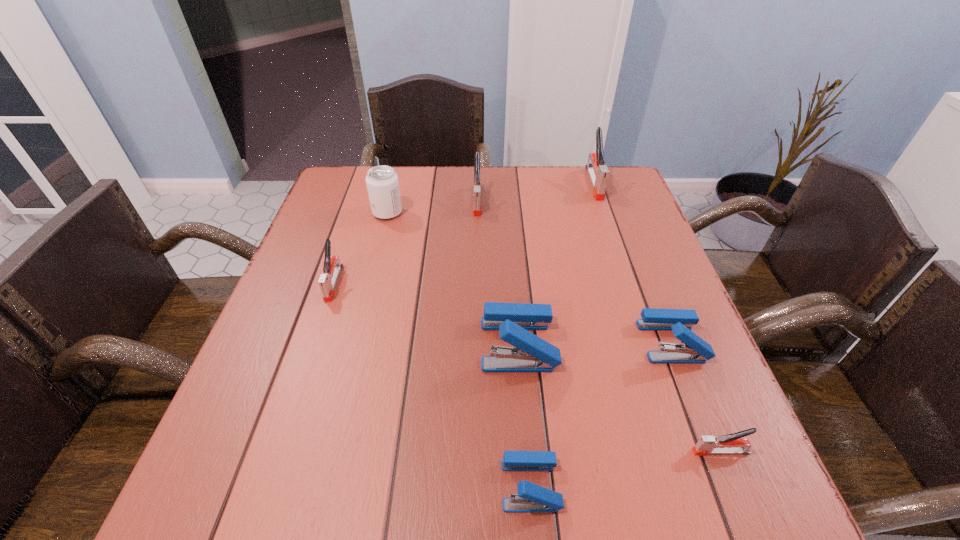
The image size is (960, 540). Identify the location of blank region between the soda can and the second biggest gray stapler. (432, 206).

Image resolution: width=960 pixels, height=540 pixels. I want to click on free space between the rightmost blue stapler and the nearest object, so click(601, 413).

This screenshot has height=540, width=960. Find the location of `vacant space in between the soda can and the nearest object`. vacant space in between the soda can and the nearest object is located at coordinates (459, 349).

You are a GUI agent. You are given a task and a screenshot of the screen. Output one action in this format:
    pyautogui.click(x=<x>, y=<y>)
    Task: Click on the empty space between the biggest gray stapler and the biggest blue stapler
    The height and width of the screenshot is (540, 960).
    Given the screenshot: What is the action you would take?
    pyautogui.click(x=556, y=264)

The height and width of the screenshot is (540, 960). What are the coordinates of `object that is the sixth closest to the second nearest gray stapler` in the screenshot? It's located at (598, 173).

Identify which object is located as the second nearest to the biggest gray stapler. Please provide its 2D coordinates. Your answer should be formatted as a tuple, i.e. [(x, y)], where the tuple contains the x and y coordinates of a point satisfying the conditions above.

[(695, 350)]

Identify which stapler is located as the sixth nearest to the rightmost blue stapler. Please provide its 2D coordinates. Your answer should be formatted as a tuple, i.e. [(x, y)], where the tuple contains the x and y coordinates of a point satisfying the conditions above.

[(327, 281)]

Find the location of a particular element. This screenshot has height=540, width=960. stapler that stands as the fifth closest to the seventh object from right to left is located at coordinates (695, 350).

Select which gray stapler is the closest to the leftmost gray stapler. Please provide its 2D coordinates. Your answer should be formatted as a tuple, i.e. [(x, y)], where the tuple contains the x and y coordinates of a point satisfying the conditions above.

[(477, 210)]

At what (x,y) coordinates should I click in order to perform the action: click on gray stapler identified as the second closest to the second nearest object. Please return your answer as a coordinate pair (x, y). The width and height of the screenshot is (960, 540). Looking at the image, I should click on coord(477,210).